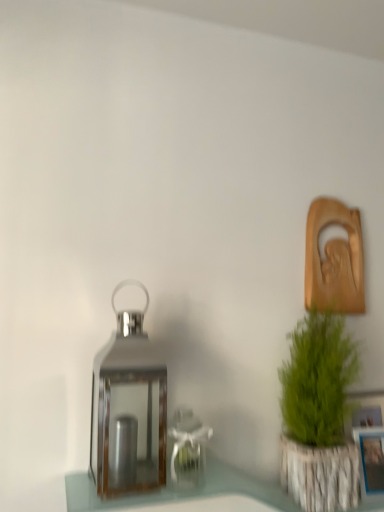
Question: Is blue plastic picture frame at lower right at the right side of shiny metallic lantern at center?

Choices:
 (A) no
 (B) yes

Answer: (B)

Question: Is the surface of blue plastic picture frame at lower right in direct contact with shiny metallic lantern at center?

Choices:
 (A) no
 (B) yes

Answer: (A)

Question: Is blue plastic picture frame at lower right thinner than shiny metallic lantern at center?

Choices:
 (A) yes
 (B) no

Answer: (A)

Question: Is blue plastic picture frame at lower right shorter than shiny metallic lantern at center?

Choices:
 (A) no
 (B) yes

Answer: (B)

Question: Does blue plastic picture frame at lower right turn towards shiny metallic lantern at center?

Choices:
 (A) no
 (B) yes

Answer: (A)

Question: From a real-world perspective, is shiny metallic lantern at center physically located above or below green textured plant at right?

Choices:
 (A) above
 (B) below

Answer: (A)

Question: From their relative heights in the image, would you say shiny metallic lantern at center is taller or shorter than green textured plant at right?

Choices:
 (A) short
 (B) tall

Answer: (A)

Question: Looking at their shapes, would you say shiny metallic lantern at center is wider or thinner than green textured plant at right?

Choices:
 (A) thin
 (B) wide

Answer: (B)

Question: From the image's perspective, is shiny metallic lantern at center positioned above or below green textured plant at right?

Choices:
 (A) above
 (B) below

Answer: (A)

Question: Does point (349, 372) appear closer or farther from the camera than point (137, 467)?

Choices:
 (A) farther
 (B) closer

Answer: (A)

Question: Considering the positions of green textured plant at right and shiny metallic lantern at center in the image, is green textured plant at right wider or thinner than shiny metallic lantern at center?

Choices:
 (A) wide
 (B) thin

Answer: (B)

Question: Considering their positions, is green textured plant at right located in front of or behind shiny metallic lantern at center?

Choices:
 (A) front
 (B) behind

Answer: (B)

Question: Do you think green textured plant at right is within shiny metallic lantern at center, or outside of it?

Choices:
 (A) inside
 (B) outside

Answer: (B)

Question: Is point (104, 482) closer or farther from the camera than point (362, 446)?

Choices:
 (A) farther
 (B) closer

Answer: (B)

Question: In terms of height, does shiny metallic lantern at center look taller or shorter compared to blue plastic picture frame at lower right?

Choices:
 (A) short
 (B) tall

Answer: (B)